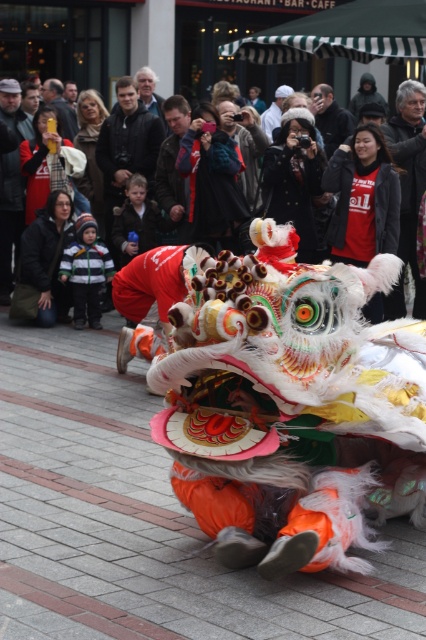
Question: Can you confirm if matte black jacket at upper center is bigger than dark gray hat at center?

Choices:
 (A) yes
 (B) no

Answer: (B)

Question: Does dark gray hat at center have a greater width compared to matte black camera at upper center?

Choices:
 (A) no
 (B) yes

Answer: (A)

Question: Does dark gray wool coat at upper center have a larger size compared to dark gray hat at center?

Choices:
 (A) yes
 (B) no

Answer: (A)

Question: Which object is positioned closest to the dark blue leather jacket at center?

Choices:
 (A) dark gray wool coat at upper center
 (B) matte black jacket at upper center
 (C) matte black camera at upper center
 (D) dark gray hat at center

Answer: (B)

Question: Estimate the real-world distances between objects in this image. Which object is closer to the dark blue leather jacket at center?

Choices:
 (A) matte black jacket at upper center
 (B) dark gray hat at center
 (C) matte black camera at upper center
 (D) dark gray wool coat at upper center

Answer: (A)

Question: Which point is closer to the camera?

Choices:
 (A) (5, 227)
 (B) (71, 128)
 (C) (406, 179)
 (D) (83, 141)

Answer: (C)